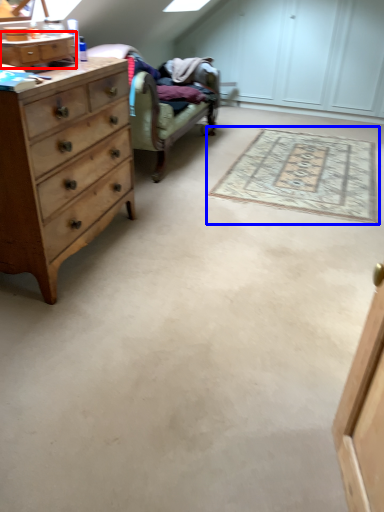
Question: Which point is further to the camera, cabinetry (highlighted by a red box) or mat (highlighted by a blue box)?

Choices:
 (A) cabinetry
 (B) mat

Answer: (B)